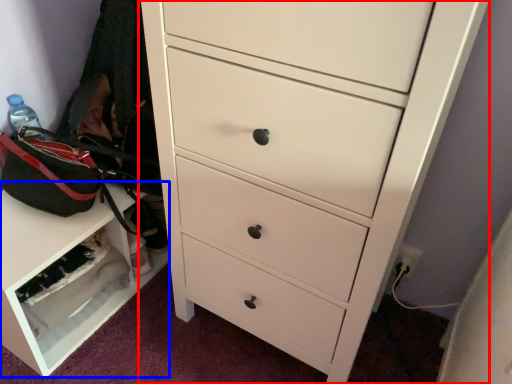
Question: Which of the following is the closest to the observer, chest of drawers (highlighted by a red box) or cabinetry (highlighted by a blue box)?

Choices:
 (A) chest of drawers
 (B) cabinetry

Answer: (A)